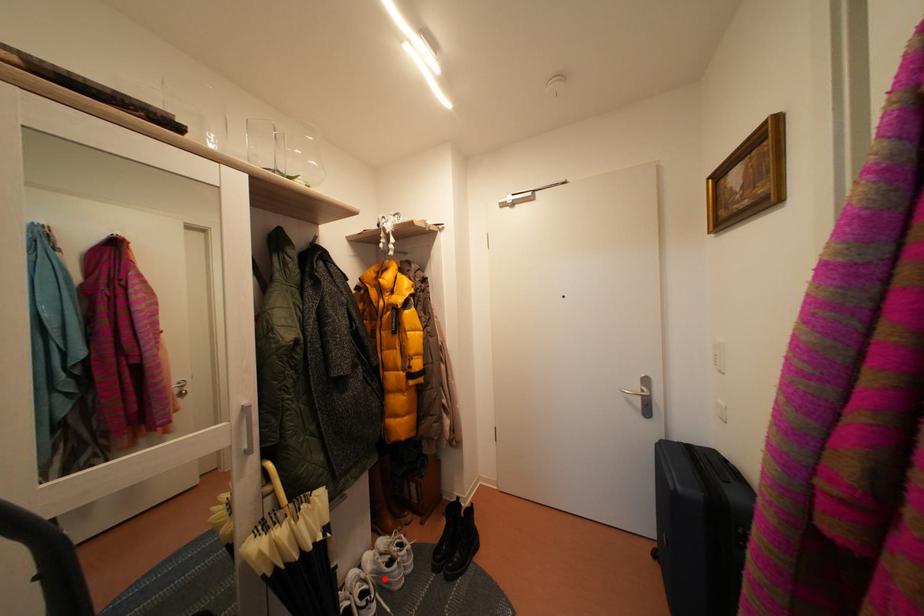
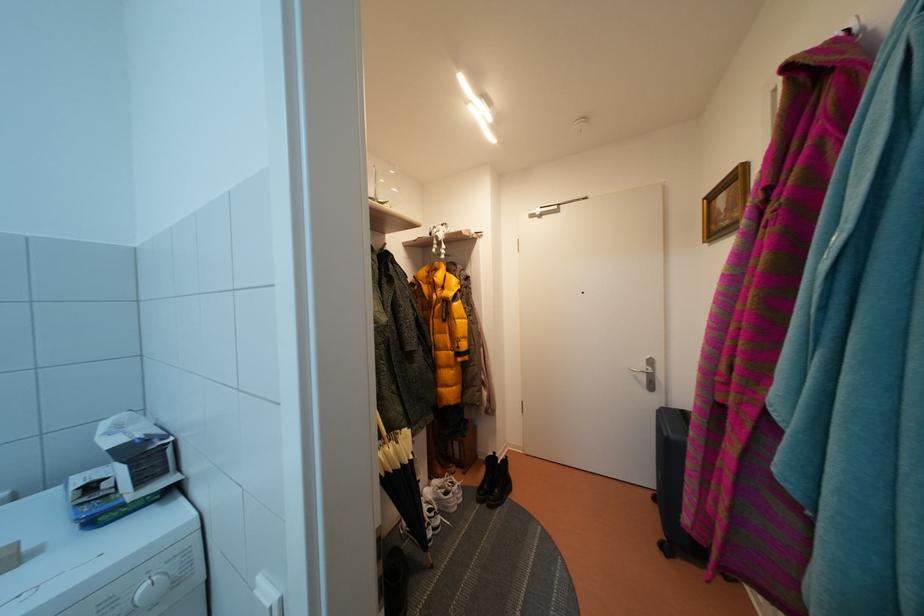
Question: A red point is marked in image1. In image2, is the corresponding 3D point closer to the camera or farther? Reply with the corresponding letter.

Choices:
 (A) The corresponding 3D point is closer.
 (B) The corresponding 3D point is farther.

Answer: (A)